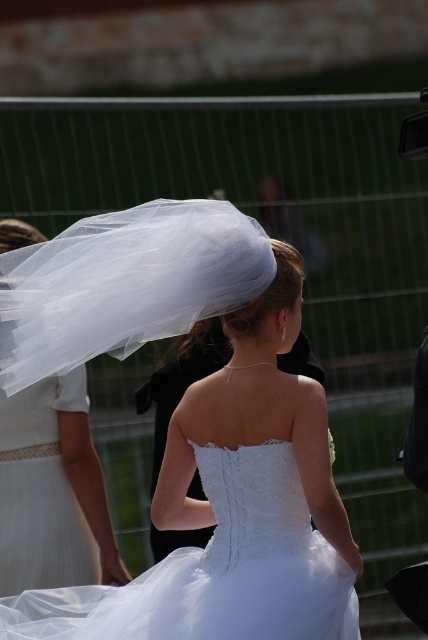
In the scene shown: Does white tulle veil at upper center appear under white tulle veil at upper left?

No.

Based on the photo, who is more forward, [264,532] or [89,516]?

Point [264,532] is in front.

Is point (318, 572) farther from camera compared to point (77, 572)?

No, (318, 572) is in front of (77, 572).

Identify the location of white tulle veil at upper center. (234, 508).